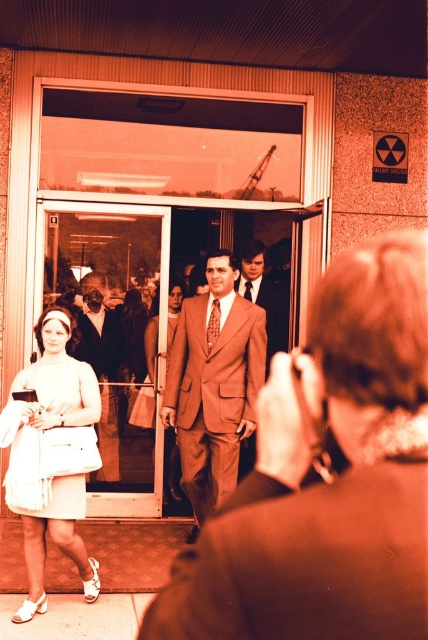
Question: Among these points, which one is nearest to the camera?

Choices:
 (A) pyautogui.click(x=219, y=394)
 (B) pyautogui.click(x=275, y=321)
 (C) pyautogui.click(x=88, y=326)

Answer: (A)

Question: Is matte white dress at lower left below satin brown suit at center?

Choices:
 (A) yes
 (B) no

Answer: (B)

Question: Which object is closer to the camera taking this photo?

Choices:
 (A) matte brown suit at center
 (B) white satin dress at lower left

Answer: (B)

Question: Among these objects, which one is farthest from the camera?

Choices:
 (A) matte brown suit at center
 (B) white satin dress at lower left
 (C) brown wool suit at center

Answer: (C)

Question: Is matte white dress at lower left behind matte brown suit at center?

Choices:
 (A) no
 (B) yes

Answer: (A)

Question: Can you confirm if light beige fabric dress at lower left is positioned to the right of brown wool suit at center?

Choices:
 (A) yes
 (B) no

Answer: (B)